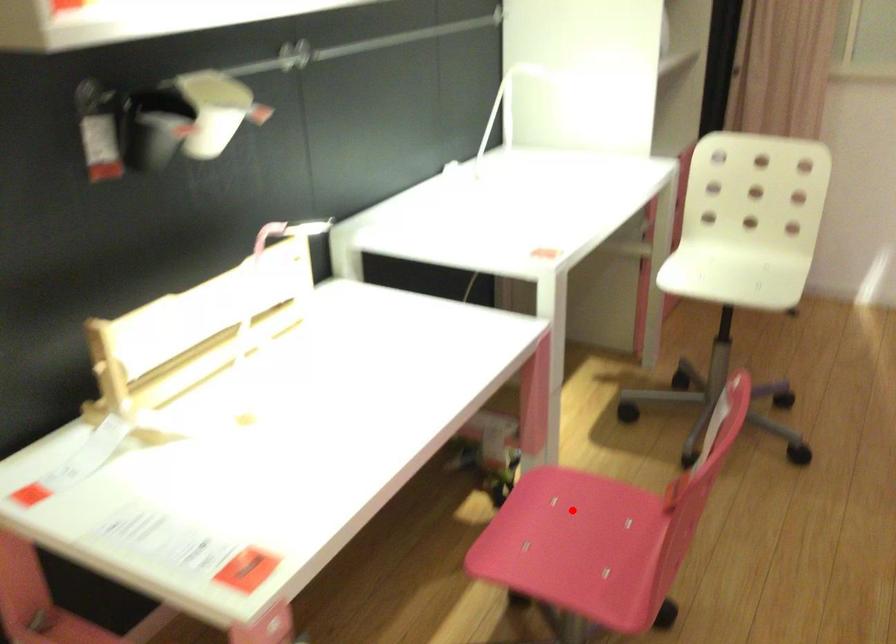
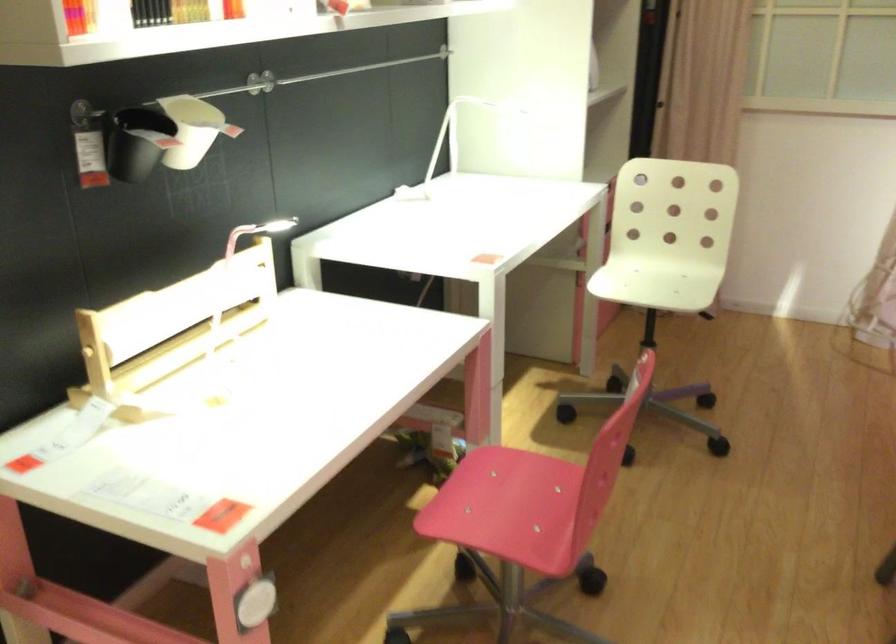
Question: I am providing you with two images of the same scene from different viewpoints. A red point is shown in image1. For the corresponding object point in image2, is it positioned nearer or farther from the camera?

Choices:
 (A) Nearer
 (B) Farther

Answer: (B)